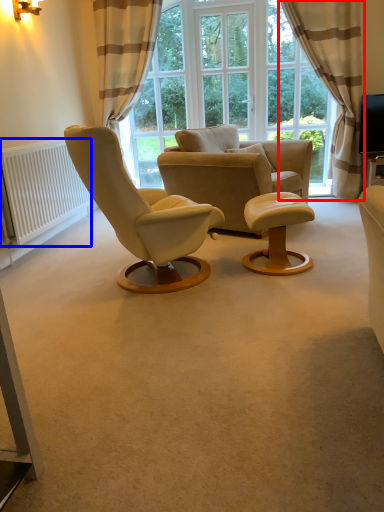
Question: Which object appears closest to the camera in this image, curtain (highlighted by a red box) or radiator (highlighted by a blue box)?

Choices:
 (A) curtain
 (B) radiator

Answer: (B)